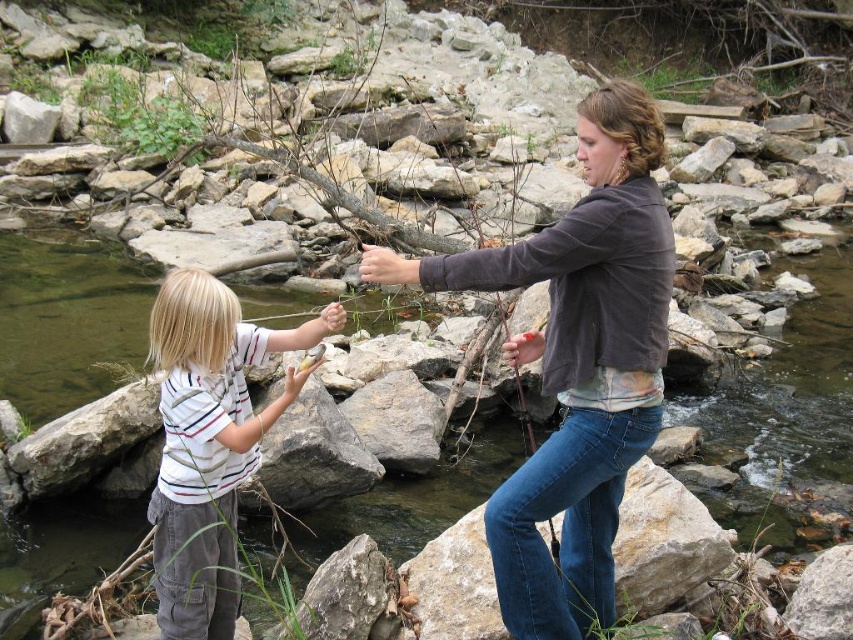
Who is taller, matte brown jacket at center or white striped shirt at center?

matte brown jacket at center is taller.

Who is more distant from viewer, [627,195] or [213,374]?

Point [213,374]

Does point (579, 128) come in front of point (260, 336)?

Yes, it is in front of point (260, 336).

Image resolution: width=853 pixels, height=640 pixels. I want to click on matte brown jacket at center, so click(x=576, y=364).